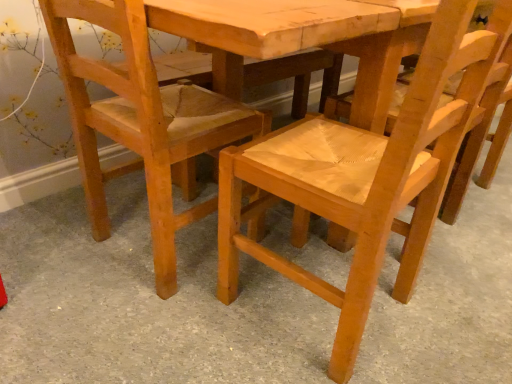
Where is `vacant space underneath light brown wood chair at lower left, which ranks as the 1th chair in left-to-right order (from a real-world perspective)`? The height and width of the screenshot is (384, 512). vacant space underneath light brown wood chair at lower left, which ranks as the 1th chair in left-to-right order (from a real-world perspective) is located at coordinates (146, 246).